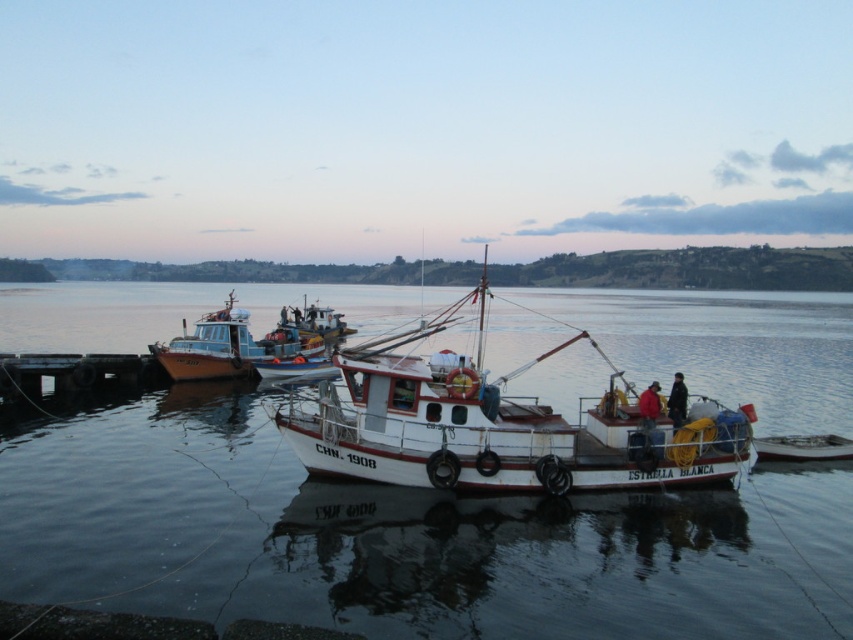
Question: Which object is farther from the camera taking this photo?

Choices:
 (A) red fabric jacket at center
 (B) black leather jacket at center
 (C) white glossy water at center

Answer: (B)

Question: Observing the image, what is the correct spatial positioning of black leather jacket at center in reference to red fabric jacket at center?

Choices:
 (A) above
 (B) below

Answer: (A)

Question: Which point is farther to the camera?

Choices:
 (A) black leather jacket at center
 (B) white glossy water at center
 (C) white matte boat at center
 (D) wooden boat at left

Answer: (D)

Question: Can you confirm if white glossy water at center is wider than black leather jacket at center?

Choices:
 (A) no
 (B) yes

Answer: (B)

Question: Is white glossy water at center further to camera compared to white matte boat at center?

Choices:
 (A) no
 (B) yes

Answer: (A)

Question: Which of the following is the closest to the observer?

Choices:
 (A) (683, 461)
 (B) (202, 339)

Answer: (A)